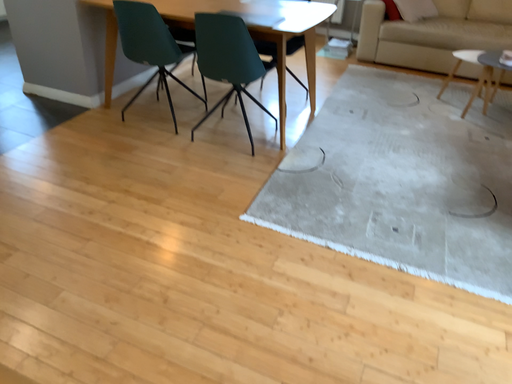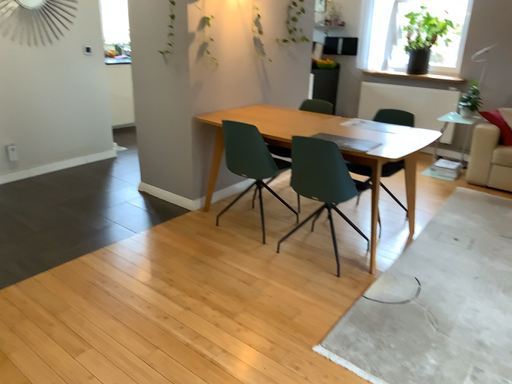
Question: How did the camera likely rotate when shooting the video?

Choices:
 (A) rotated upward
 (B) rotated downward

Answer: (A)